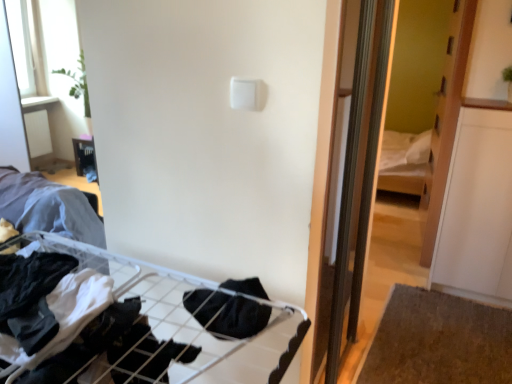
Describe the element at coordinates (193, 314) in the screenshot. This screenshot has width=512, height=384. I see `black fabric clothes at lower left` at that location.

Measure the distance between point (119,378) and camera.

The depth of point (119,378) is 1.03 meters.

In order to face black fabric clothes at lower left, should I rotate leftwards or rightwards?

You should look left and rotate roughly 24.602 degrees.

Find the location of a particular element. black fabric clothes at lower left is located at coordinates (193, 314).

Identify the location of black fabric clothes at lower left. pyautogui.click(x=193, y=314).